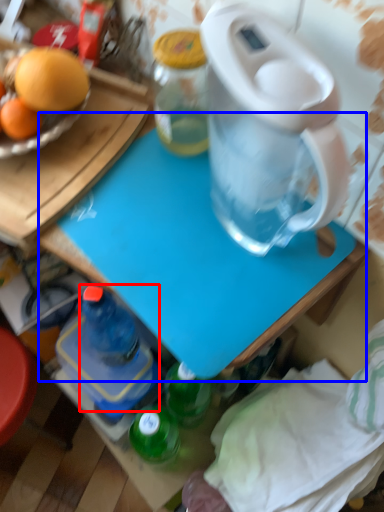
Question: Among these objects, which one is farthest to the camera, bottle (highlighted by a red box) or table (highlighted by a blue box)?

Choices:
 (A) bottle
 (B) table

Answer: (A)